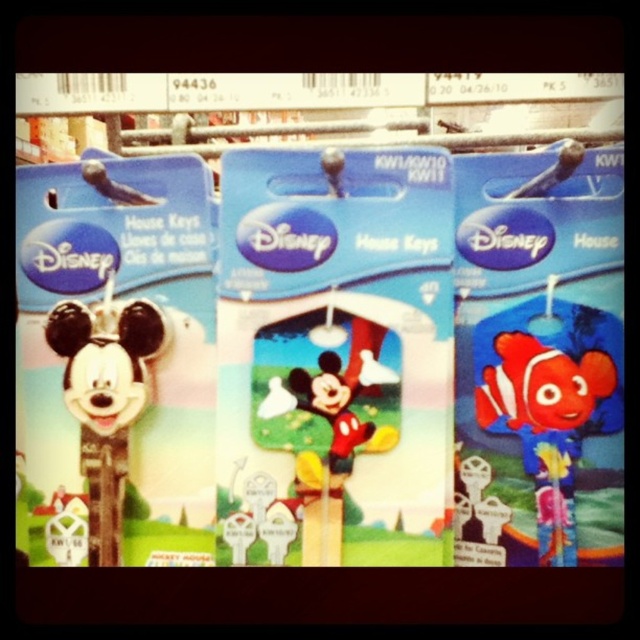
You are standing in an aquarium and see a red rubber clownfish at center. If you want to touch it, will you be able to reach it if your arm is 75 centimeters long?

The red rubber clownfish at center is 81.21 centimeters away from the viewer. Since your arm is only 75 centimeters long, you cannot reach it.

You are holding a red rubber clownfish at center and want to see the matte black mickey mouse keychain at left. Can you move the red rubber clownfish to the side to view it better?

The matte black mickey mouse keychain at left is behind the red rubber clownfish at center, so moving the red rubber clownfish to the side would allow you to see the matte black mickey mouse keychain at left better.

You are an underwater explorer looking for a red rubber clownfish at center. Based on the coordinates provided in the scene description, can you determine its exact location?

The red rubber clownfish at center is located at point (548, 413).